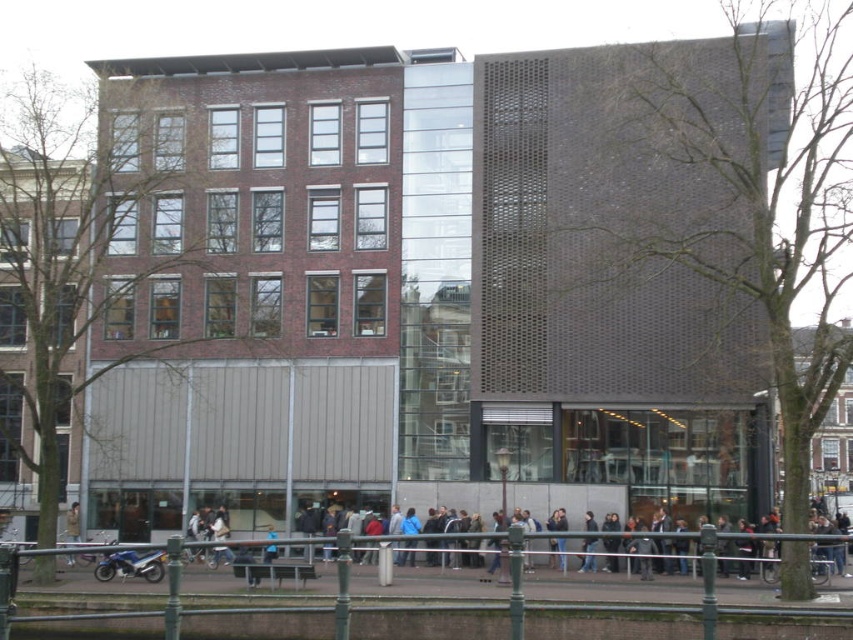
Does blue metallic motorcycle at lower left appear under khaki fabric jacket at center?

No, blue metallic motorcycle at lower left is not below khaki fabric jacket at center.

Who is positioned more to the left, blue metallic motorcycle at lower left or khaki fabric jacket at center?

Positioned to the left is khaki fabric jacket at center.

Where is `blue metallic motorcycle at lower left`? Image resolution: width=853 pixels, height=640 pixels. blue metallic motorcycle at lower left is located at coordinates (131, 564).